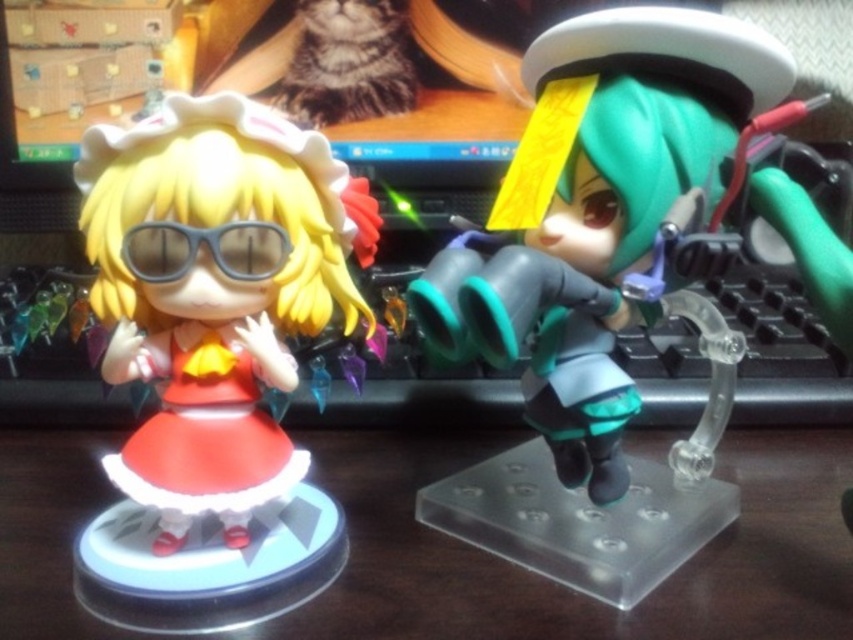
Question: Does wooden table at center lie behind matte black figurine at left?

Choices:
 (A) yes
 (B) no

Answer: (A)

Question: Can you confirm if wooden table at center is positioned below matte black figurine at left?

Choices:
 (A) yes
 (B) no

Answer: (A)

Question: Considering the real-world distances, which object is farthest from the matte black goggles at left?

Choices:
 (A) teal matte figure at right
 (B) matte black figurine at left

Answer: (A)

Question: Among these points, which one is farthest from the camera?

Choices:
 (A) (276, 184)
 (B) (250, 241)

Answer: (B)

Question: Estimate the real-world distances between objects in this image. Which object is closer to the matte black goggles at left?

Choices:
 (A) wooden table at center
 (B) teal matte figure at right

Answer: (B)

Question: Where is teal matte figure at right located in relation to matte black figurine at left in the image?

Choices:
 (A) left
 (B) right

Answer: (B)